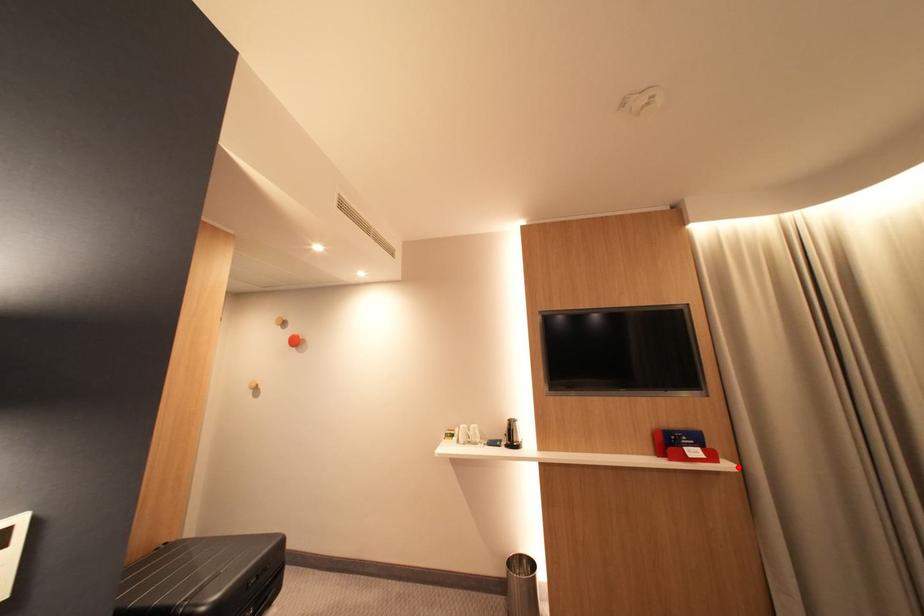
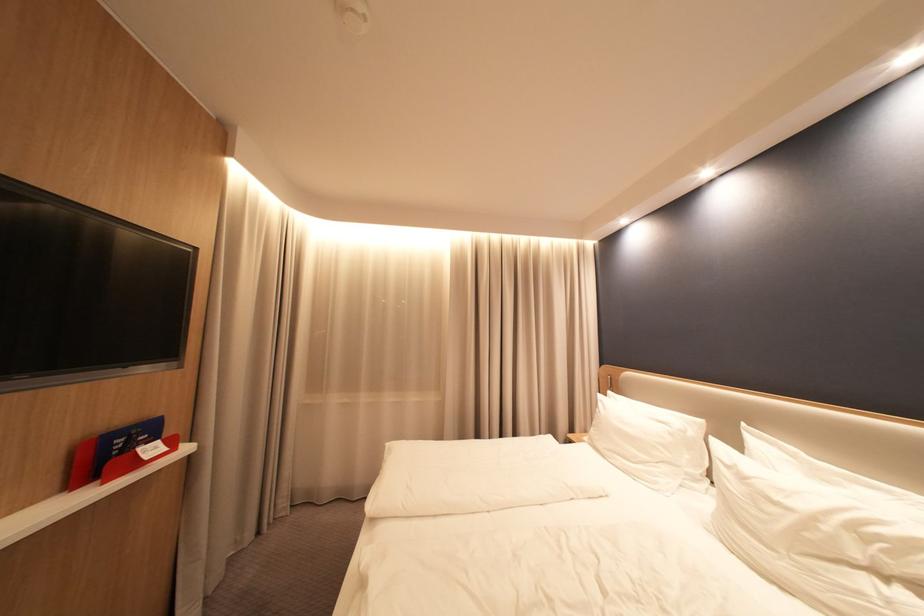
Where in the second image is the point corresponding to the highlighted location from the first image?

(197, 450)